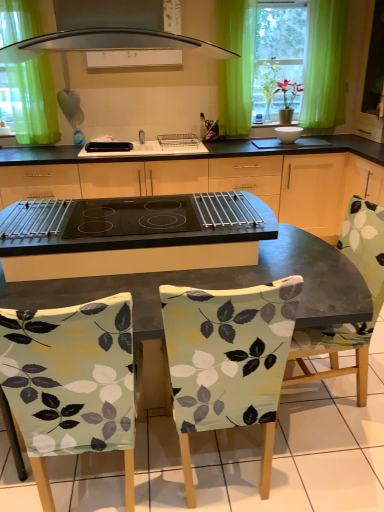
This screenshot has width=384, height=512. Find the location of `unoccupied area behind white glossy bowl at center, positioned as the 2th appliance in left-to-right order`. unoccupied area behind white glossy bowl at center, positioned as the 2th appliance in left-to-right order is located at coordinates coord(287,135).